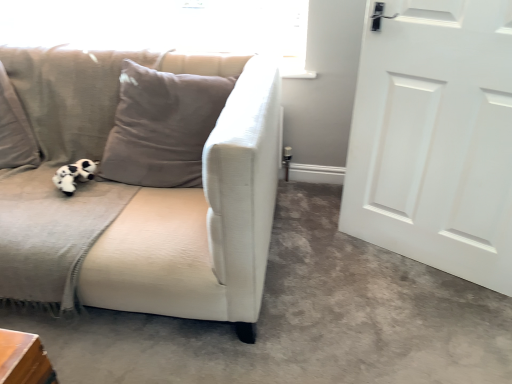
Where is `vacant space in white matte door at right (from a real-world perspective)`? The width and height of the screenshot is (512, 384). vacant space in white matte door at right (from a real-world perspective) is located at coordinates (420, 258).